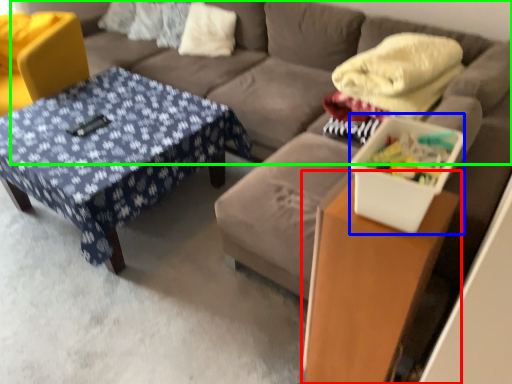
Question: Which object is the closest to the table (highlighted by a red box)? Choose among these: storage box (highlighted by a blue box) or futon (highlighted by a green box).

Choices:
 (A) storage box
 (B) futon

Answer: (A)